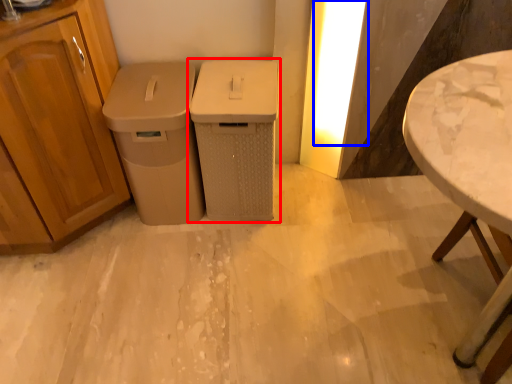
Question: Which object appears closest to the camera in this image, waste container (highlighted by a red box) or light (highlighted by a blue box)?

Choices:
 (A) waste container
 (B) light

Answer: (A)